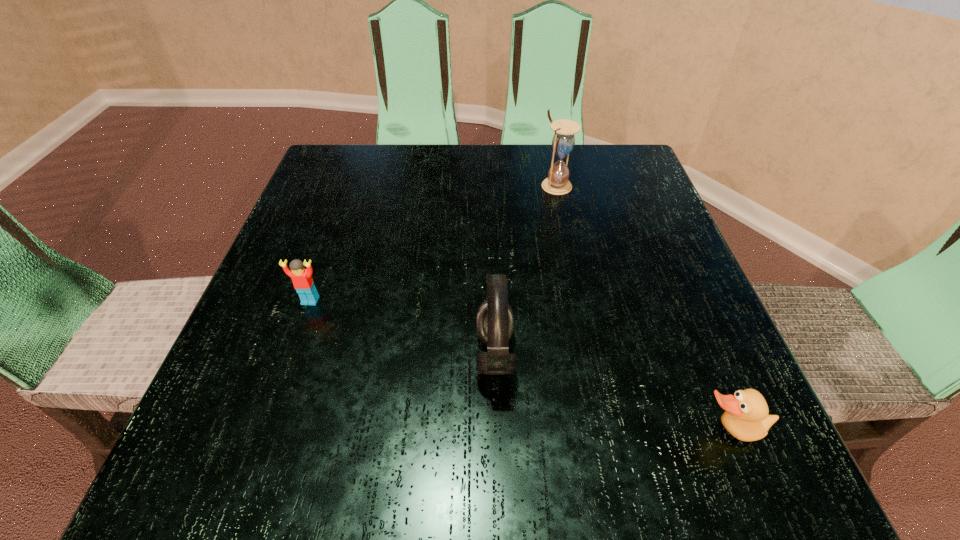
Image resolution: width=960 pixels, height=540 pixels. In order to click on hourglass in this screenshot , I will do `click(563, 141)`.

Where is `the farthest object`? The image size is (960, 540). the farthest object is located at coordinates (563, 141).

This screenshot has height=540, width=960. What are the coordinates of `the second nearest object` in the screenshot? It's located at (494, 321).

This screenshot has height=540, width=960. In order to click on headset in this screenshot , I will do `click(494, 321)`.

Identify the location of Lego. The width and height of the screenshot is (960, 540). (302, 279).

The image size is (960, 540). Identify the location of the leftmost object. (302, 279).

You are a GUI agent. You are given a task and a screenshot of the screen. Output one action in this format:
    pyautogui.click(x=<x>, y=<y>)
    Task: Click on the nearest object
    Image resolution: width=960 pixels, height=540 pixels.
    Given the screenshot: What is the action you would take?
    pyautogui.click(x=746, y=417)

Locate an element on the screen. This screenshot has height=540, width=960. duck is located at coordinates (746, 417).

Locate an element on the screen. The image size is (960, 540). vacant space located on the front of the farthest object is located at coordinates (579, 293).

Find the location of a particular element. vacant space located 0.190m on the earcups of the third farthest object is located at coordinates click(352, 355).